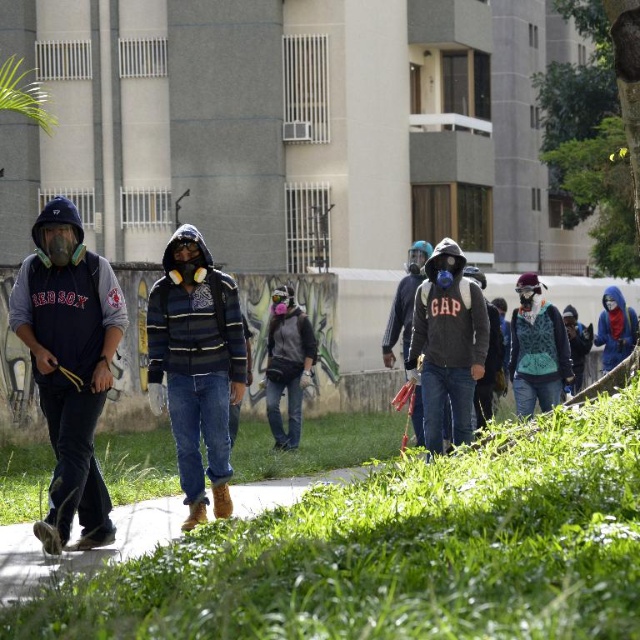
Consider the image. You are a photographer trying to capture a group of protesters in an urban setting. You need to ensure that both the matte gray jacket at center and the blue matte jacket at right are in focus in your photo. Given that your camera has a depth of field that can cover 12 feet, will you be able to achieve this?

The matte gray jacket at center and blue matte jacket at right are 12.79 feet apart. Since the camera can only cover 12 feet, the distance between them exceeds the depth of field capacity. Therefore, you won cannot ensure both jackets are in focus simultaneously.